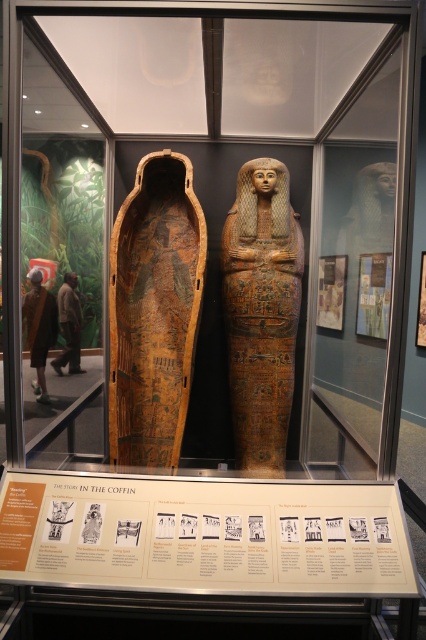
Question: Among these objects, which one is farthest from the camera?

Choices:
 (A) wooden sarcophagus at center
 (B) golden polished sarcophagus at center

Answer: (B)

Question: Can you confirm if wooden sarcophagus at center is positioned to the left of golden polished sarcophagus at center?

Choices:
 (A) no
 (B) yes

Answer: (B)

Question: Is wooden sarcophagus at center closer to the viewer compared to golden polished sarcophagus at center?

Choices:
 (A) no
 (B) yes

Answer: (B)

Question: Among these points, which one is farthest from the camera?

Choices:
 (A) (166, 241)
 (B) (296, 292)

Answer: (A)

Question: Can you confirm if wooden sarcophagus at center is positioned below golden polished sarcophagus at center?

Choices:
 (A) no
 (B) yes

Answer: (A)